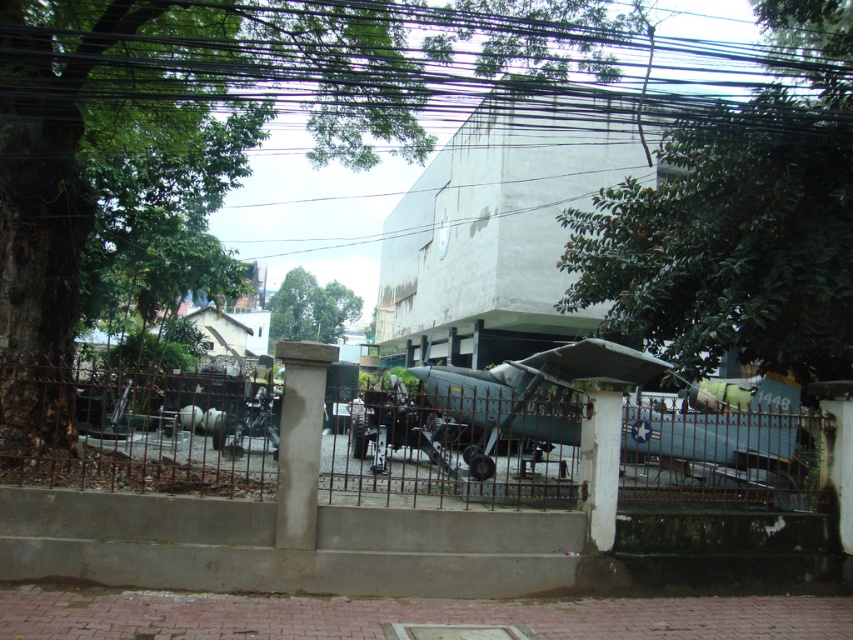
Who is shorter, black wire at upper center or rusty metal fence at center?

With less height is rusty metal fence at center.

Does black wire at upper center appear under rusty metal fence at center?

No, black wire at upper center is not below rusty metal fence at center.

Is point (334, 26) less distant than point (637, 504)?

No, it is not.

Where is `black wire at upper center`? black wire at upper center is located at coordinates (352, 72).